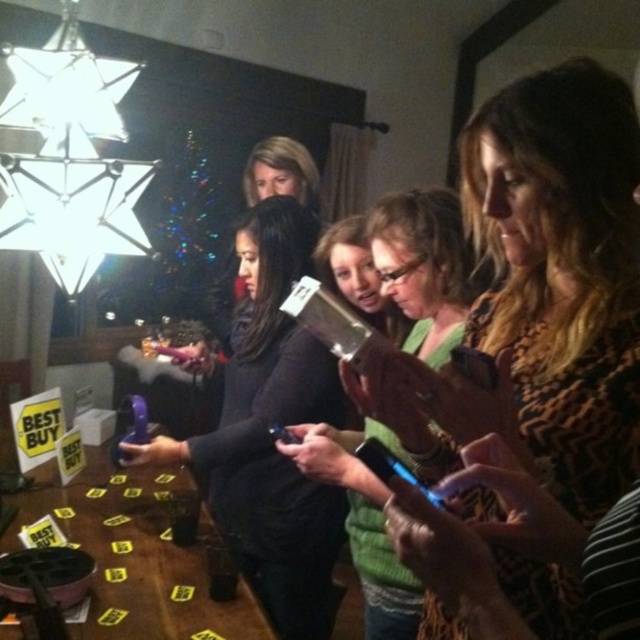
You are at a holiday party and want to place a gift card between the leopard print scarf at center and the matte black phone at center on the table. Which object should you place the gift card closer to if you want it to be near the shorter item?

The leopard print scarf at center is shorter than the matte black phone at center, so you should place the gift card closer to the leopard print scarf at center.

Consider the image. You are at a holiday party and see a leopard print scarf at center and yellow paper placards at lower left on the table. Which item is closer to the top edge of the table?

The leopard print scarf at center is above the yellow paper placards at lower left, so it is closer to the top edge of the table.